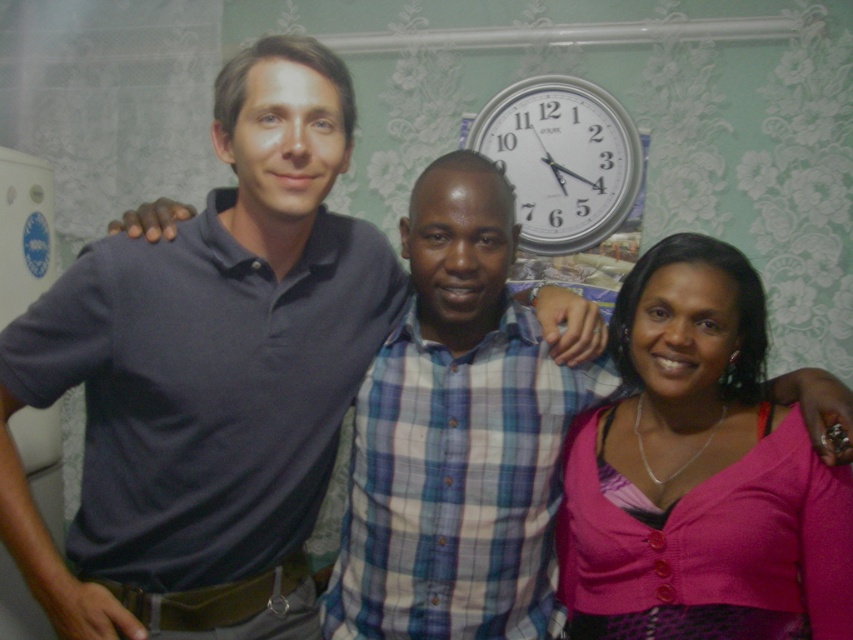
You are standing in the room and want to reach a specific point marked at coordinates point (283, 97). If you can walk 4 feet per second, how long will it take you to reach that point?

The distance of point (283, 97) from camera is 3.59 feet. At a walking speed of 4 feet per second, it will take approximately 0.8975 seconds, which rounds to about 0.9 seconds to reach the point.

You are standing in the room and want to check the time on the silver metallic clock at upper center without moving from your spot. Can you see the dark blue polo shirt at center blocking your view?

The dark blue polo shirt at center and silver metallic clock at upper center are 3.98 feet apart from each other, so the distance between them is sufficient to allow an unobstructed view of the clock. Therefore, you can see the silver metallic clock at upper center without the dark blue polo shirt at center blocking your view.

You are standing in the room with the three people. You need to place a small sticker on the wall between the two points, point (711, 282) and point (602, 116). Which point should the sticker be closer to so that it appears closer to the people in the photo?

The sticker should be placed closer to point (711, 282) because it is in front of point (602, 116), making it visually closer to the people in the photo.